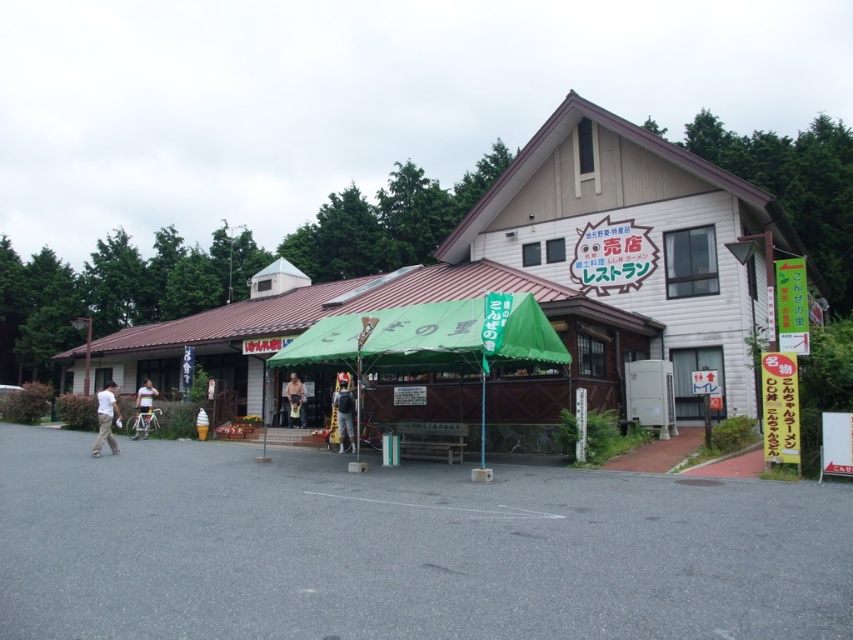
Between point (494, 388) and point (112, 442), which one is positioned behind?

The point (494, 388) is behind.

Is wooden tent at center positioned before white cotton shirt at lower left?

Yes, wooden tent at center is closer to the viewer.

Image resolution: width=853 pixels, height=640 pixels. Describe the element at coordinates (381, 308) in the screenshot. I see `wooden tent at center` at that location.

In order to click on wooden tent at center in this screenshot , I will do `click(381, 308)`.

Between wooden restaurant at center and wooden tent at center, which one has less height?

wooden tent at center is shorter.

Does wooden restaurant at center appear under wooden tent at center?

No.

Between point (273, 310) and point (564, 371), which one is positioned in front?

Positioned in front is point (564, 371).

Image resolution: width=853 pixels, height=640 pixels. I want to click on wooden restaurant at center, so click(x=556, y=257).

Is wooden restaurant at center thinner than white cotton shirt at lower left?

Incorrect, wooden restaurant at center's width is not less than white cotton shirt at lower left's.

Does wooden restaurant at center have a lesser height compared to white cotton shirt at lower left?

In fact, wooden restaurant at center may be taller than white cotton shirt at lower left.

Which is behind, point (160, 339) or point (99, 416)?

The point (160, 339) is more distant.

Find the location of a particular element. This screenshot has width=853, height=640. wooden restaurant at center is located at coordinates (556, 257).